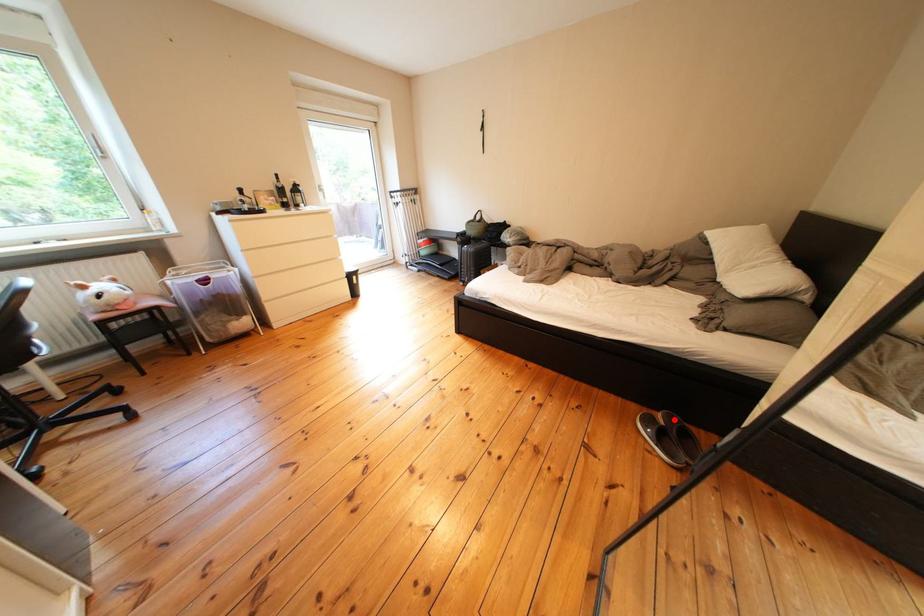
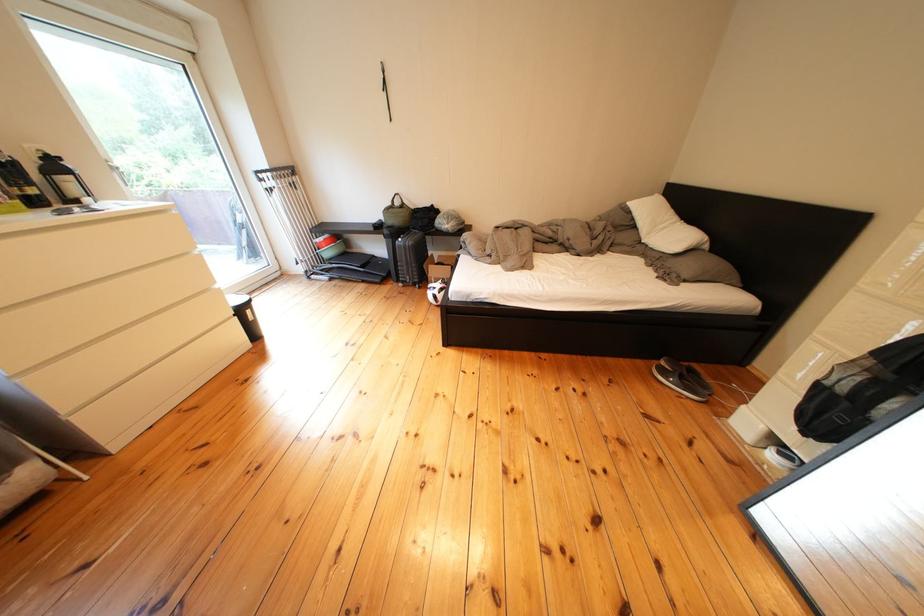
The point at the highlighted location is marked in the first image. Where is the corresponding point in the second image?

(676, 368)